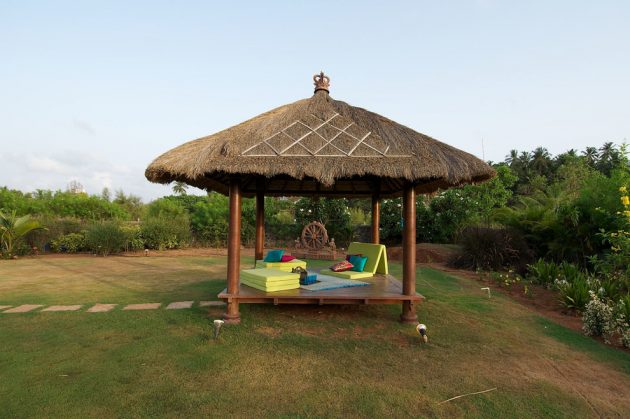
Identify the location of lights. Image resolution: width=630 pixels, height=419 pixels. (218, 321), (419, 326).